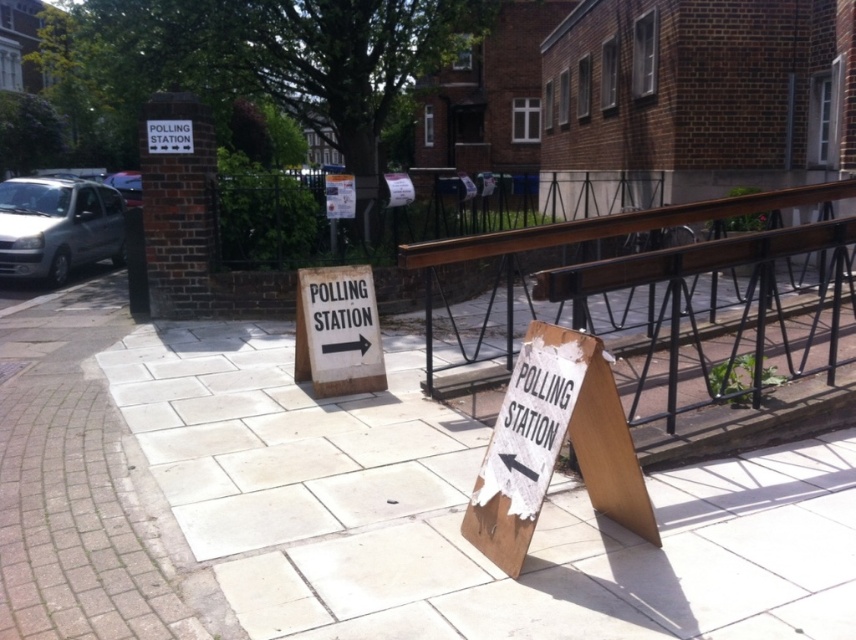
Who is shorter, white stone pavement at center or wooden sign at lower right?

Standing shorter between the two is white stone pavement at center.

Does white stone pavement at center have a smaller size compared to wooden sign at lower right?

Yes.

What do you see at coordinates (352, 504) in the screenshot?
I see `white stone pavement at center` at bounding box center [352, 504].

You are a GUI agent. You are given a task and a screenshot of the screen. Output one action in this format:
    pyautogui.click(x=<x>, y=<y>)
    Task: Click on the white stone pavement at center
    
    Given the screenshot: What is the action you would take?
    pyautogui.click(x=352, y=504)

Does point (502, 458) come closer to viewer compared to point (605, 220)?

Yes, it is.

How far apart are wooden sign at lower right and brown wooden rail at center?

wooden sign at lower right and brown wooden rail at center are 2.38 meters apart.

Between point (495, 557) and point (428, 304), which one is positioned behind?

Point (428, 304)

You are a GUI agent. You are given a task and a screenshot of the screen. Output one action in this format:
    pyautogui.click(x=<x>, y=<y>)
    Task: Click on the wooden sign at lower right
    
    Given the screenshot: What is the action you would take?
    pyautogui.click(x=554, y=445)

Can you confirm if white stone pavement at center is wider than brown wooden rail at center?

In fact, white stone pavement at center might be narrower than brown wooden rail at center.

Which of these two, white stone pavement at center or brown wooden rail at center, stands taller?

brown wooden rail at center is taller.

Is point (247, 346) positioned after point (718, 216)?

Yes, point (247, 346) is farther from viewer.

The width and height of the screenshot is (856, 640). In order to click on white stone pavement at center in this screenshot , I will do `click(352, 504)`.